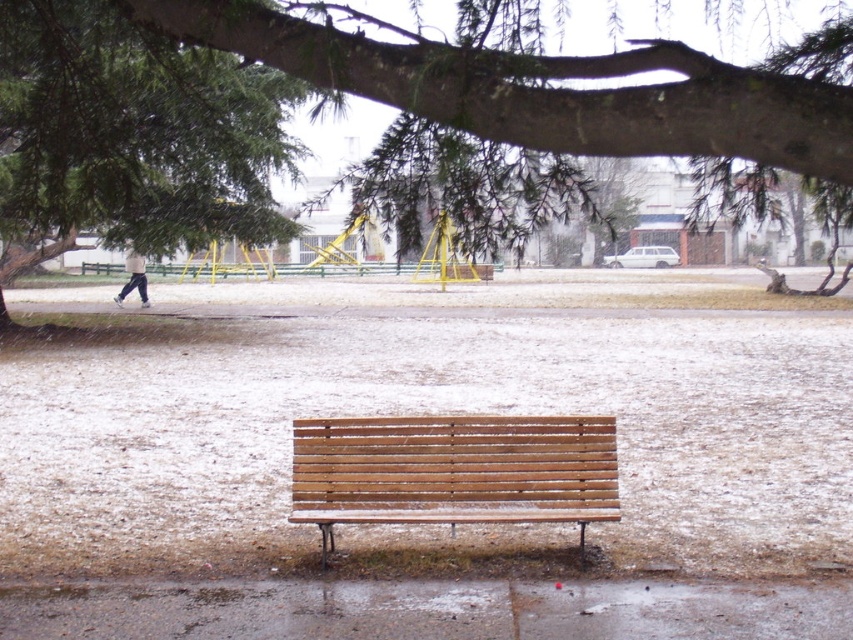
Question: Does green textured branch at upper center have a larger size compared to light brown wooden bench at center?

Choices:
 (A) no
 (B) yes

Answer: (B)

Question: Which of the following is the closest to the observer?

Choices:
 (A) green textured branch at upper center
 (B) light brown wooden bench at center
 (C) white cotton pants at left

Answer: (A)

Question: Which point appears farthest from the camera in this image?

Choices:
 (A) (711, 90)
 (B) (140, 305)
 (C) (583, 480)

Answer: (B)

Question: Among these points, which one is nearest to the camera?

Choices:
 (A) (128, 284)
 (B) (376, 426)

Answer: (B)

Question: In this image, where is green textured branch at upper center located relative to white cotton pants at left?

Choices:
 (A) above
 (B) below

Answer: (A)

Question: Can you confirm if light brown wooden bench at center is positioned above white cotton pants at left?

Choices:
 (A) no
 (B) yes

Answer: (A)